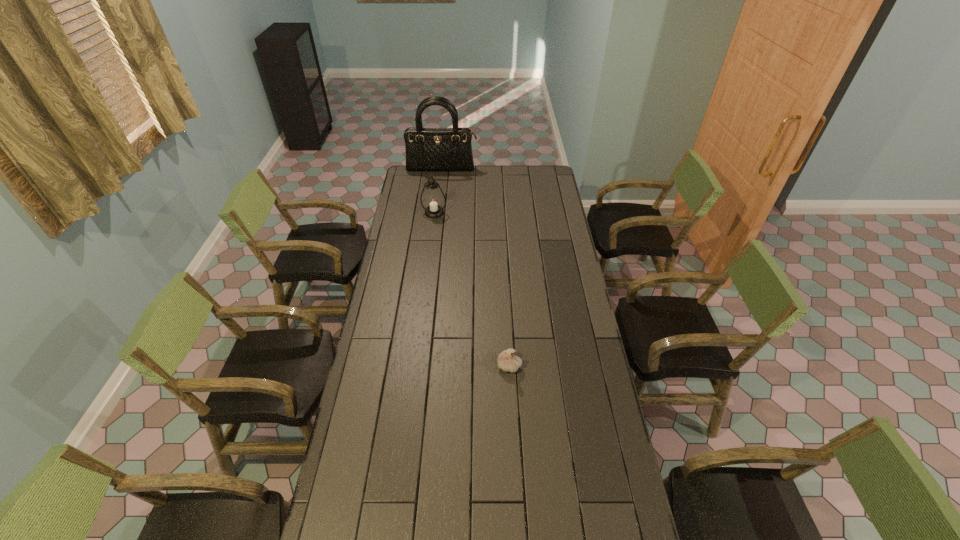
Find the location of `free space between the handbag and the second shortest object`. free space between the handbag and the second shortest object is located at coordinates (438, 191).

Where is `object that is the second closest to the tallest object`? object that is the second closest to the tallest object is located at coordinates (507, 360).

The image size is (960, 540). I want to click on object that is the second closest to the oil lamp, so click(507, 360).